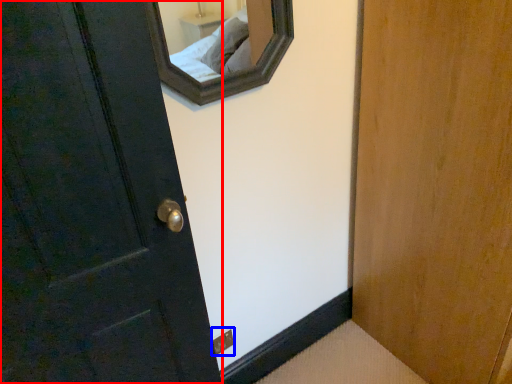
Question: Which object appears closest to the camera in this image, door (highlighted by a red box) or electric outlet (highlighted by a blue box)?

Choices:
 (A) door
 (B) electric outlet

Answer: (A)